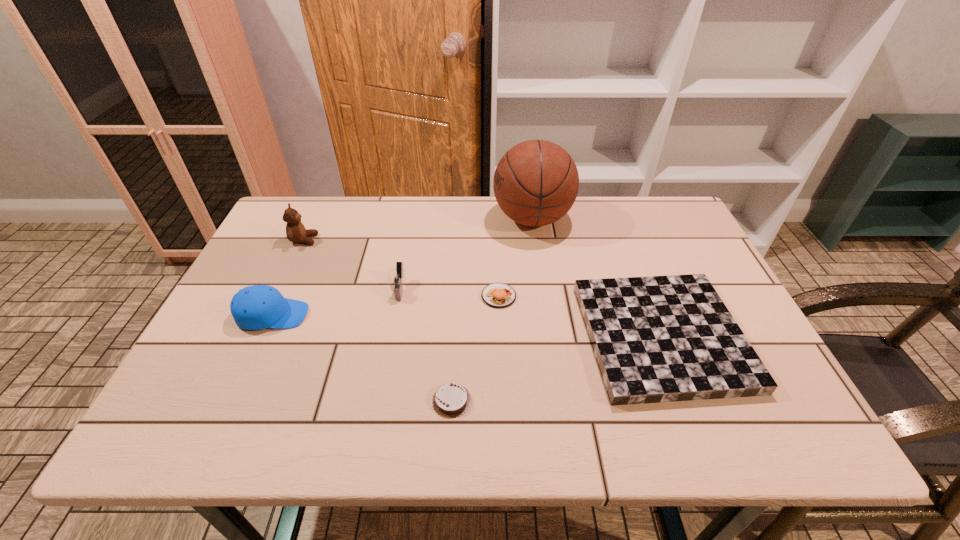
This screenshot has height=540, width=960. In order to click on vacant area situated on the side with brand label of the tallest object in this screenshot , I will do `click(404, 219)`.

Where is `blank space located 0.140m at the face of the second tallest object`? The image size is (960, 540). blank space located 0.140m at the face of the second tallest object is located at coordinates (364, 240).

At what (x,y) coordinates should I click in order to perform the action: click on free space located on the left of the fifth object from right to left. Please return your answer as a coordinate pair (x, y). The image size is (960, 540). Looking at the image, I should click on (297, 289).

Image resolution: width=960 pixels, height=540 pixels. Find the location of `free space located on the front-facing side of the cap`. free space located on the front-facing side of the cap is located at coordinates 420,315.

Identify the location of vacant space positioned 0.060m on the front of the patty. The image size is (960, 540). (500, 327).

Find the location of a particular element. The image size is (960, 540). vacant space positioned on the left of the checkerboard is located at coordinates [420, 336].

The height and width of the screenshot is (540, 960). Identify the location of vacant region located 0.340m on the right of the fourth object from left to right. (635, 401).

Find the location of a particular element. The image size is (960, 540). basketball at the far edge is located at coordinates (536, 182).

You are a GUI agent. You are given a task and a screenshot of the screen. Output one action in this format:
    pyautogui.click(x=<x>, y=<y>)
    Task: Click on the teddy bear that is at the far edge
    The height and width of the screenshot is (540, 960).
    Given the screenshot: What is the action you would take?
    pyautogui.click(x=295, y=231)

In order to click on checkerboard that is positioned at the near edge in this screenshot , I will do `click(656, 339)`.